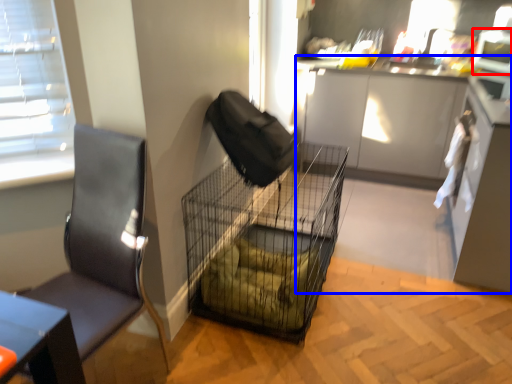
Question: Which object is closer to the camera taking this photo, appliance (highlighted by a red box) or cabinetry (highlighted by a blue box)?

Choices:
 (A) appliance
 (B) cabinetry

Answer: (B)